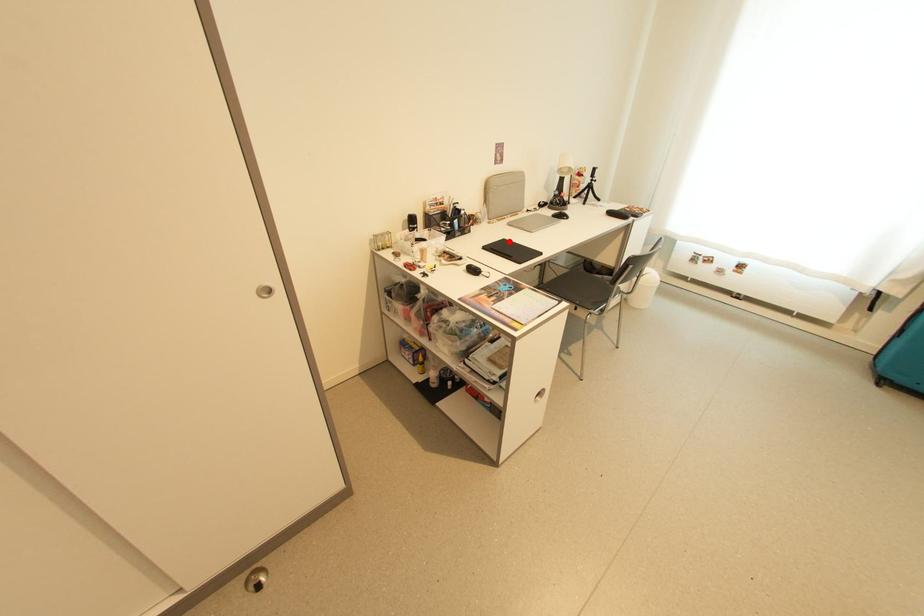
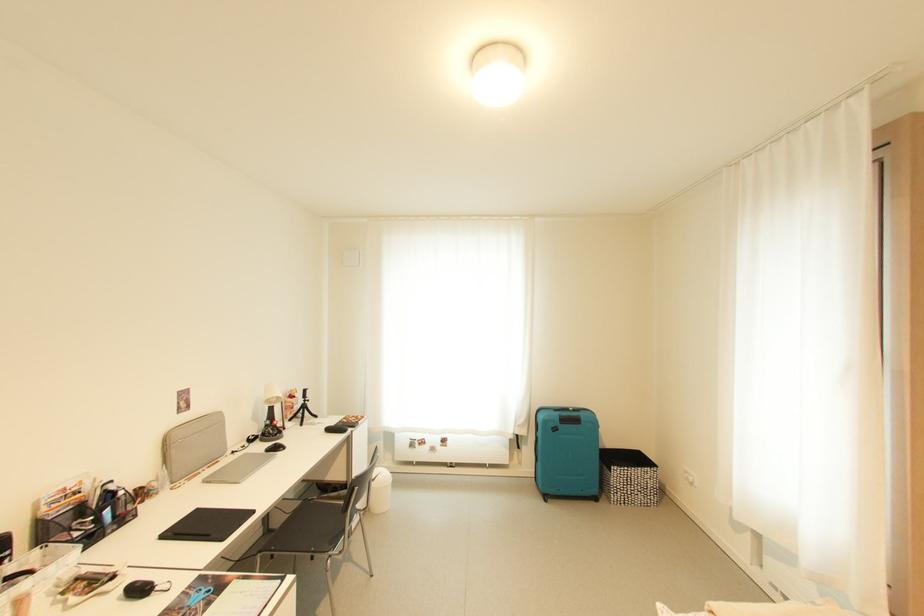
Locate, in the second image, the point that corresponds to the highlighted location in the first image.

(202, 512)